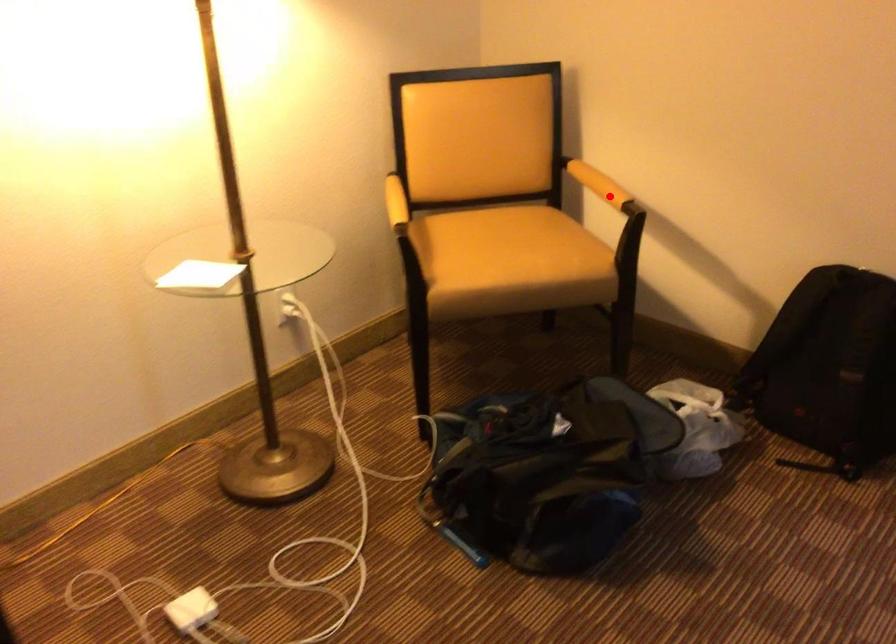
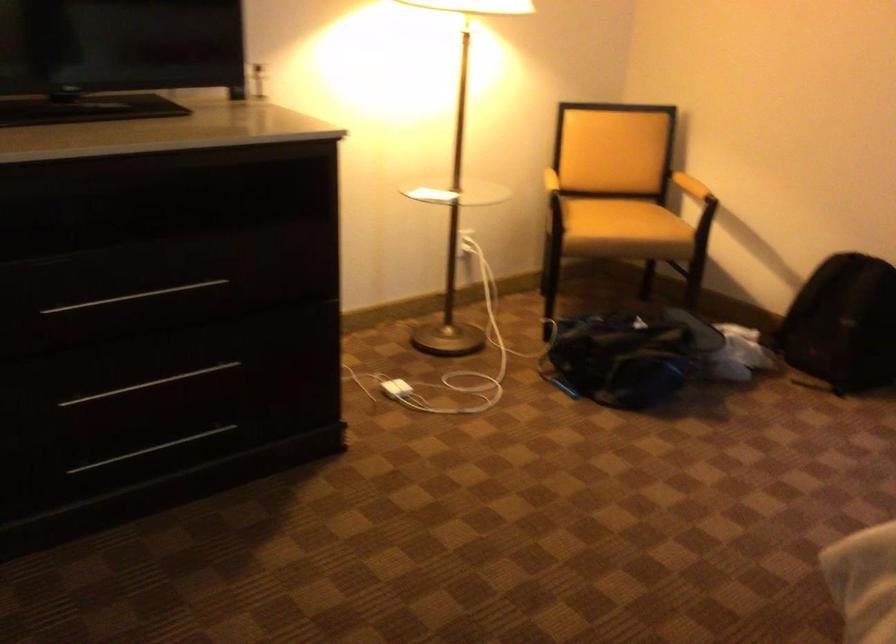
Question: I am providing you with two images of the same scene from different viewpoints. A red point is marked on the first image. Is the red point's position out of view in image 2?

Choices:
 (A) Yes
 (B) No

Answer: (B)